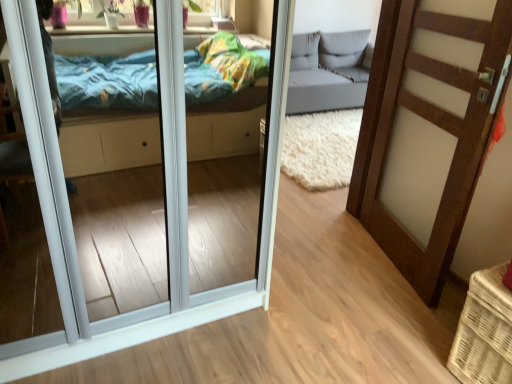
Locate an element on the screen. This screenshot has height=384, width=512. vacant region to the left of brown wood door at right, which is the 2th door from left to right is located at coordinates (321, 260).